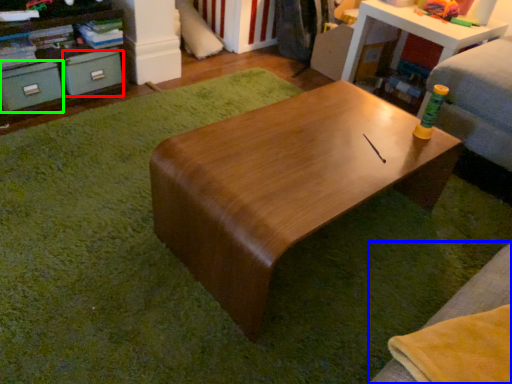
Question: Which object is the closest to the drawer (highlighted by a red box)? Choose among these: couch (highlighted by a blue box) or drawer (highlighted by a green box).

Choices:
 (A) couch
 (B) drawer

Answer: (B)